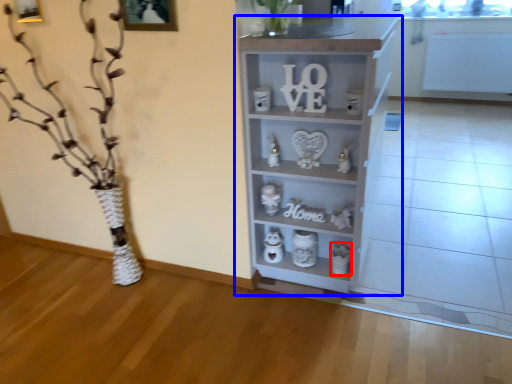
Question: Among these objects, which one is farthest to the camera, toy (highlighted by a red box) or shelf (highlighted by a blue box)?

Choices:
 (A) toy
 (B) shelf

Answer: (A)